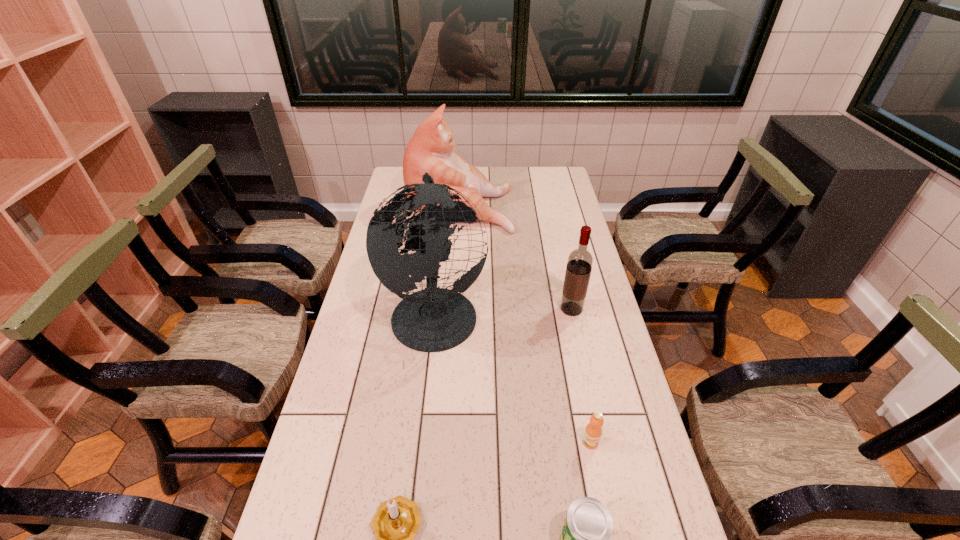
Identify the location of cat present at the left edge. click(x=431, y=149).

Find the location of a particular element. wine bottle that is at the right edge is located at coordinates (579, 264).

In order to click on orange juice that is at the right edge in this screenshot , I will do `click(593, 431)`.

Locate an element on the screen. Image resolution: width=960 pixels, height=540 pixels. object located in the far left corner section of the desktop is located at coordinates (431, 149).

The width and height of the screenshot is (960, 540). Find the location of `vacant space at the left edge of the desktop`. vacant space at the left edge of the desktop is located at coordinates (360, 460).

Locate an element on the screen. This screenshot has width=960, height=540. free space at the right edge of the desktop is located at coordinates (593, 260).

Identify the location of free area in between the wine bottle and the farthest object. Image resolution: width=960 pixels, height=540 pixels. (516, 257).

I want to click on object that stands as the second closest to the fourth shortest object, so click(431, 149).

Identify which object is the third nearest to the globe. Please provide its 2D coordinates. Your answer should be formatted as a tuple, i.e. [(x, y)], where the tuple contains the x and y coordinates of a point satisfying the conditions above.

[(593, 431)]

This screenshot has height=540, width=960. What are the coordinates of `vacant area in the image that satisfies the following two spatial constraints: 1. on the face of the cat; 2. on the right side of the fourth shortest object` in the screenshot? It's located at (454, 309).